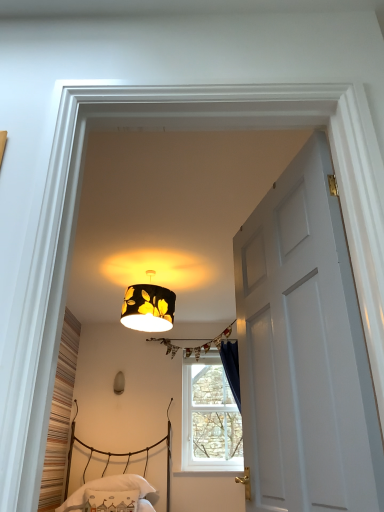
This screenshot has height=512, width=384. Identify the location of white glossy door at center. (304, 350).

Measure the distance between white plastic window at center and camera.

The depth of white plastic window at center is 3.97 meters.

Where is `white cotton pillow at lower center`? The width and height of the screenshot is (384, 512). white cotton pillow at lower center is located at coordinates (111, 492).

What are the coordinates of `white glossy door at center` in the screenshot? It's located at (304, 350).

Is white glossy door at center not near black fabric lampshade at center, marked as the first lamp in a front-to-back arrangement?

Yes, white glossy door at center and black fabric lampshade at center, marked as the first lamp in a front-to-back arrangement, are located far from each other.

Who is smaller, white glossy door at center or black fabric lampshade at center, the 1th lamp positioned from the top?

black fabric lampshade at center, the 1th lamp positioned from the top.

Is white glossy door at center facing towards black fabric lampshade at center, the second lamp positioned from the left?

No.

In the image, is white glossy door at center on the left side or the right side of black fabric lampshade at center, positioned as the 1th lamp in right-to-left order?

white glossy door at center is positioned on black fabric lampshade at center, positioned as the 1th lamp in right-to-left order,'s right side.

From the image's perspective, starting from the white fabric pillow at lower center, which lamp is the 2nd one above? Please provide its 2D coordinates.

[(148, 308)]

Is black fabric lampshade at center, the 1th lamp positioned from the top, at the back of white fabric pillow at lower center?

white fabric pillow at lower center is not turned away from black fabric lampshade at center, the 1th lamp positioned from the top.

Which of these two, white fabric pillow at lower center or black fabric lampshade at center, the 2th lamp when ordered from bottom to top, stands shorter?

Standing shorter between the two is white fabric pillow at lower center.

Would you say white fabric pillow at lower center is a long distance from black fabric lampshade at center, marked as the first lamp in a front-to-back arrangement?

white fabric pillow at lower center is far away from black fabric lampshade at center, marked as the first lamp in a front-to-back arrangement.

Looking at this image, in the image, is white plastic window at center positioned in front of or behind white fabric pillow at lower center?

Visually, white plastic window at center is located behind white fabric pillow at lower center.

Does white plastic window at center appear on the left side of white fabric pillow at lower center?

→ Incorrect, white plastic window at center is not on the left side of white fabric pillow at lower center.

Which is less distant, (190,462) or (114,501)?

Point (190,462) appears to be farther away from the viewer than point (114,501).

Identify the location of window located above the white fabric pillow at lower center (from the image's perspective). The image size is (384, 512). click(209, 417).

Considering the sizes of objects matte yellow fabric lampshade at upper center, which ranks as the second lamp in top-to-bottom order, and white fabric pillow at lower center in the image provided, who is smaller, matte yellow fabric lampshade at upper center, which ranks as the second lamp in top-to-bottom order, or white fabric pillow at lower center?

Smaller between the two is matte yellow fabric lampshade at upper center, which ranks as the second lamp in top-to-bottom order.

Considering the positions of points (121, 393) and (132, 506), is point (121, 393) closer to camera compared to point (132, 506)?

No, (121, 393) is further to viewer.

Is matte yellow fabric lampshade at upper center, which is counted as the 2th lamp, starting from the right, surrounding white fabric pillow at lower center?

No, white fabric pillow at lower center is not inside matte yellow fabric lampshade at upper center, which is counted as the 2th lamp, starting from the right.

From a real-world perspective, which is physically above, matte yellow fabric lampshade at upper center, which is the first lamp from back to front, or white fabric pillow at lower center?

From a 3D spatial view, matte yellow fabric lampshade at upper center, which is the first lamp from back to front, is above.

Is point (120, 499) closer to viewer compared to point (305, 340)?

No, it is not.

Considering their positions, is white cotton pillow at lower center located in front of or behind white glossy door at center?

white cotton pillow at lower center is behind white glossy door at center.

Is white cotton pillow at lower center facing towards white glossy door at center?

Yes, white cotton pillow at lower center is facing white glossy door at center.

Does white cotton pillow at lower center have a lesser height compared to white glossy door at center?

Yes, white cotton pillow at lower center is shorter than white glossy door at center.

In the scene shown: Is matte yellow fabric lampshade at upper center, which ranks as the second lamp in top-to-bottom order, outside of white plastic window at center?

That's correct, matte yellow fabric lampshade at upper center, which ranks as the second lamp in top-to-bottom order, is outside of white plastic window at center.

Considering the relative sizes of matte yellow fabric lampshade at upper center, which is the first lamp from bottom to top, and white plastic window at center in the image provided, is matte yellow fabric lampshade at upper center, which is the first lamp from bottom to top, taller than white plastic window at center?

No.

Is point (119, 387) closer or farther from the camera than point (184, 349)?

Point (119, 387) is closer to the camera than point (184, 349).

From a real-world perspective, which object rests below the other?

white plastic window at center, from a real-world perspective.

Does point (207, 406) lie in front of point (347, 376)?

No, (207, 406) is behind (347, 376).

Can you confirm if white plastic window at center is taller than white glossy door at center?

Indeed, white plastic window at center has a greater height compared to white glossy door at center.

Would you consider white plastic window at center to be distant from white glossy door at center?

Yes, white plastic window at center is far from white glossy door at center.

Find the location of `the 2nd lamp positioned above the white glossy door at center (from a real-world perspective)`. the 2nd lamp positioned above the white glossy door at center (from a real-world perspective) is located at coordinates (148, 308).

Locate an element on the screen. the 2nd lamp positioned above the white fabric pillow at lower center (from the image's perspective) is located at coordinates (148, 308).

Looking at the image, which one is located further to matte yellow fabric lampshade at upper center, which is the first lamp from back to front, black fabric lampshade at center, the second lamp positioned from the left, or white glossy door at center?

Based on the image, white glossy door at center appears to be further to matte yellow fabric lampshade at upper center, which is the first lamp from back to front.

When comparing their distances from white glossy door at center, does black fabric lampshade at center, positioned as the 1th lamp in right-to-left order, or white fabric pillow at lower center seem closer?

The object closer to white glossy door at center is black fabric lampshade at center, positioned as the 1th lamp in right-to-left order.

Consider the image. Estimate the real-world distances between objects in this image. Which object is closer to black fabric lampshade at center, the 2th lamp when ordered from bottom to top, white fabric pillow at lower center or white plastic window at center?

The object closer to black fabric lampshade at center, the 2th lamp when ordered from bottom to top, is white plastic window at center.

From the image, which object appears to be farther from white fabric pillow at lower center, white glossy door at center or white plastic window at center?

white glossy door at center is further to white fabric pillow at lower center.

Based on their spatial positions, is black fabric lampshade at center, arranged as the second lamp when viewed from the back, or matte yellow fabric lampshade at upper center, which is counted as the 1th lamp, starting from the left, closer to white plastic window at center?

Based on the image, matte yellow fabric lampshade at upper center, which is counted as the 1th lamp, starting from the left, appears to be nearer to white plastic window at center.

Considering their positions, is white glossy door at center positioned closer to white cotton pillow at lower center than white plastic window at center?

white plastic window at center is closer to white cotton pillow at lower center.

When comparing their distances from black fabric lampshade at center, positioned as the 1th lamp in right-to-left order, does white glossy door at center or white cotton pillow at lower center seem closer?

white cotton pillow at lower center.

Estimate the real-world distances between objects in this image. Which object is closer to white cotton pillow at lower center, white plastic window at center or matte yellow fabric lampshade at upper center, which is the second lamp in front-to-back order?

white plastic window at center.

The width and height of the screenshot is (384, 512). In order to click on lamp between white glossy door at center and white cotton pillow at lower center along the z-axis in this screenshot , I will do `click(148, 308)`.

This screenshot has height=512, width=384. I want to click on bedding between white fabric pillow at lower center and matte yellow fabric lampshade at upper center, which is counted as the 2th lamp, starting from the right, in the front-back direction, so click(111, 492).

Identify the location of bedding positioned between white glossy door at center and matte yellow fabric lampshade at upper center, which is counted as the 2th lamp, starting from the right, from near to far. This screenshot has height=512, width=384. (111, 492).

Identify the location of window between black fabric lampshade at center, the second lamp positioned from the left, and matte yellow fabric lampshade at upper center, which ranks as the second lamp in top-to-bottom order, along the z-axis. This screenshot has height=512, width=384. (209, 417).